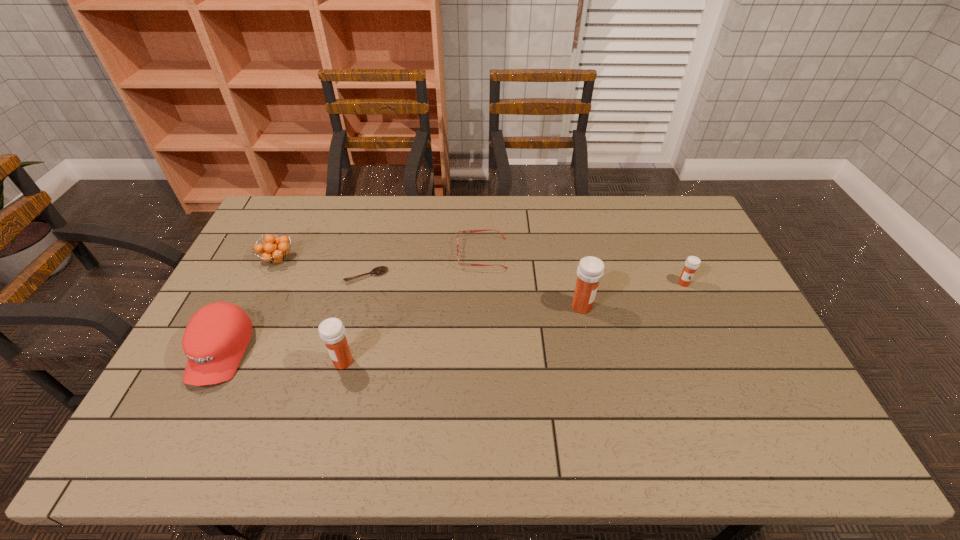
Locate an element on the screen. This screenshot has height=540, width=960. vacant space situated on the back of the shortest object is located at coordinates (385, 206).

This screenshot has width=960, height=540. I want to click on object at the near edge, so click(215, 339).

Where is `orange fruit that is at the left edge`? The height and width of the screenshot is (540, 960). orange fruit that is at the left edge is located at coordinates (275, 250).

Where is `cap present at the left edge`? cap present at the left edge is located at coordinates (215, 339).

This screenshot has width=960, height=540. Find the location of `object present at the right edge`. object present at the right edge is located at coordinates (692, 263).

At what (x,y) coordinates should I click in order to perform the action: click on object situated at the near left corner. Please return your answer as a coordinate pair (x, y). The image size is (960, 540). Looking at the image, I should click on (215, 339).

The width and height of the screenshot is (960, 540). I want to click on free region at the far edge of the desktop, so click(620, 229).

Find the location of a particular element. This screenshot has width=960, height=540. free space at the near edge is located at coordinates (433, 387).

Find the location of a particular element. This screenshot has width=960, height=540. blank space at the left edge of the desktop is located at coordinates (251, 293).

The width and height of the screenshot is (960, 540). In order to click on free space at the right edge of the desktop in this screenshot , I will do `click(701, 251)`.